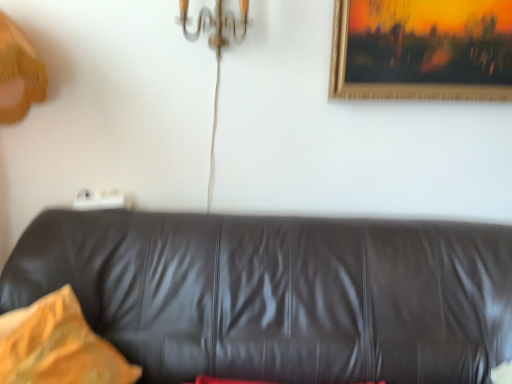
Question: Considering the positions of gold-framed painting at upper right and black leather couch at center in the image, is gold-framed painting at upper right wider or thinner than black leather couch at center?

Choices:
 (A) wide
 (B) thin

Answer: (B)

Question: Is point (486, 26) positioned closer to the camera than point (389, 294)?

Choices:
 (A) closer
 (B) farther

Answer: (B)

Question: Based on their relative distances, which object is farther from the black leather couch at center?

Choices:
 (A) gold-framed painting at upper right
 (B) yellow fabric pillow at left

Answer: (A)

Question: Which is nearer to the gold-framed painting at upper right?

Choices:
 (A) black leather couch at center
 (B) yellow fabric pillow at left

Answer: (A)